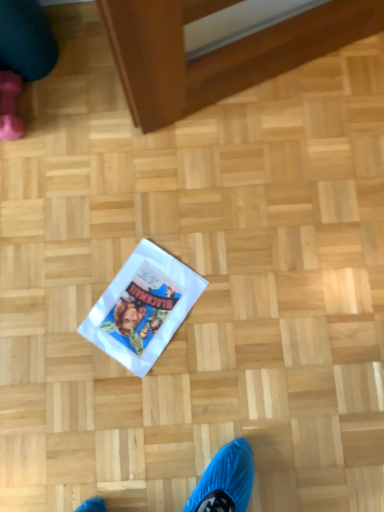
You are a GUI agent. You are given a task and a screenshot of the screen. Output one action in this format:
    pyautogui.click(x=<x>, y=<y>)
    Task: Click on the vacant space underneath white paper flyer at center (from a real-world perspective)
    The image size is (384, 512).
    Given the screenshot: What is the action you would take?
    pyautogui.click(x=150, y=304)